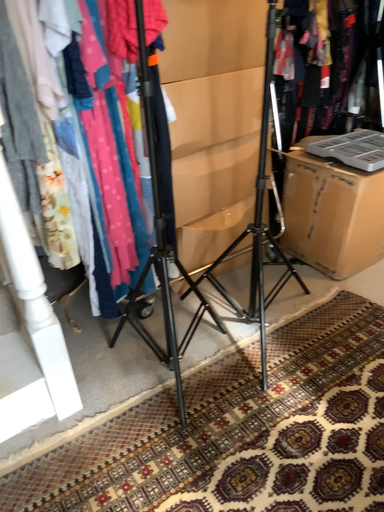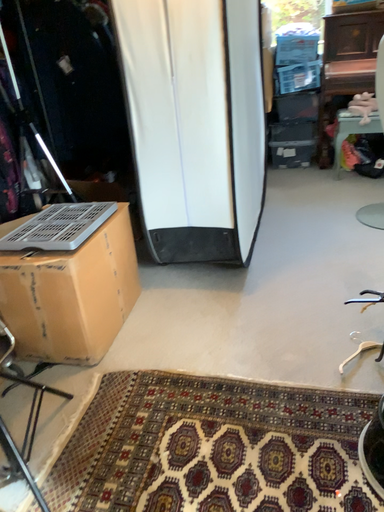
Question: Which way did the camera rotate in the video?

Choices:
 (A) rotated upward
 (B) rotated downward

Answer: (A)